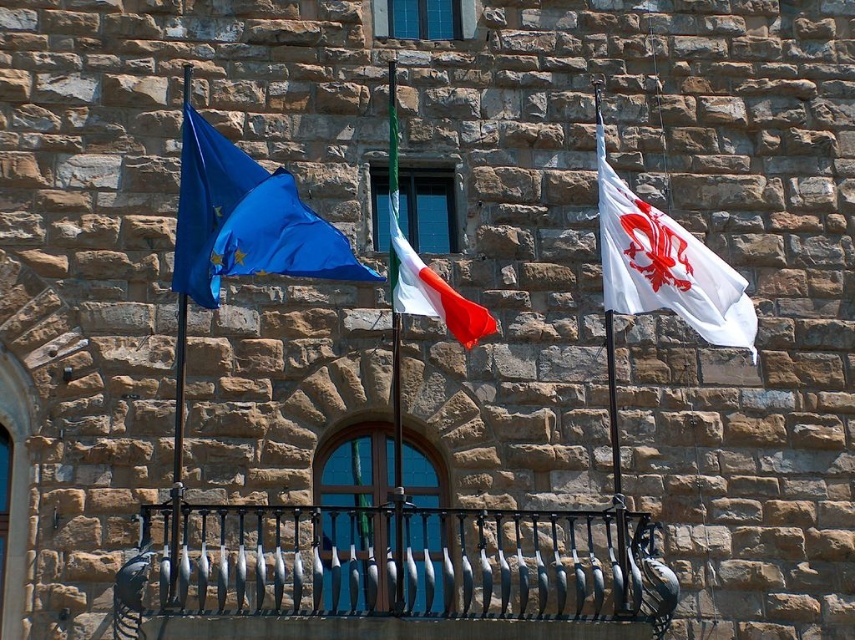
You are a photographer standing in front of the stone building with three flags. You need to capture a photo where both the blue fabric flag at upper left and the white matte flag at right are visible. Based on their heights, which flag will appear taller in the photo?

The white matte flag at right is taller than the blue fabric flag at upper left, so it will appear taller in the photo.

You are standing in front of the stone building and want to take a photo of the blue fabric flag at upper left and the white matte flag at right. Which flag will appear larger in your photo?

The blue fabric flag at upper left will appear larger in the photo because it is closer to the viewer than the white matte flag at right.